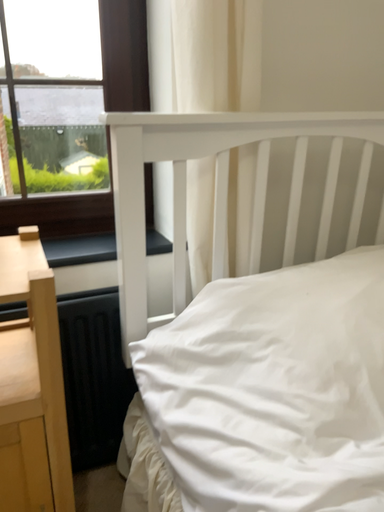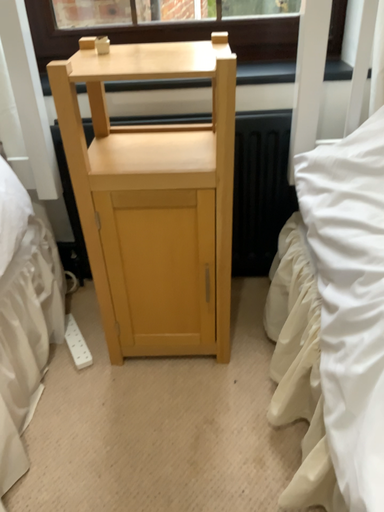
Question: How did the camera likely rotate when shooting the video?

Choices:
 (A) rotated downward
 (B) rotated upward

Answer: (A)